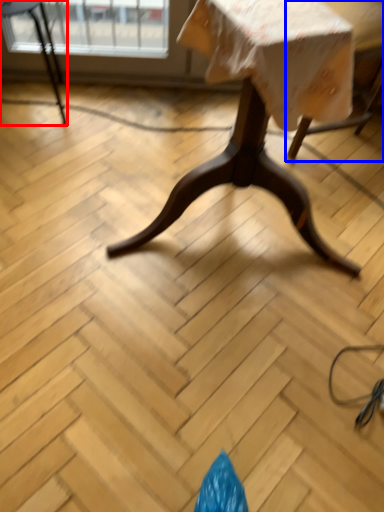
Question: Which object is further to the camera taking this photo, chair (highlighted by a red box) or swivel chair (highlighted by a blue box)?

Choices:
 (A) chair
 (B) swivel chair

Answer: (A)